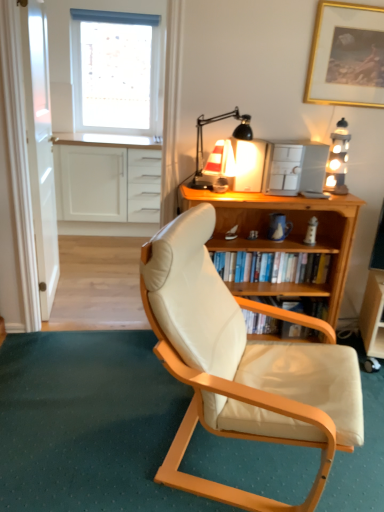
Locate an element on the screen. vacant space to the left of matte cream leather chair at center is located at coordinates pyautogui.click(x=97, y=421).